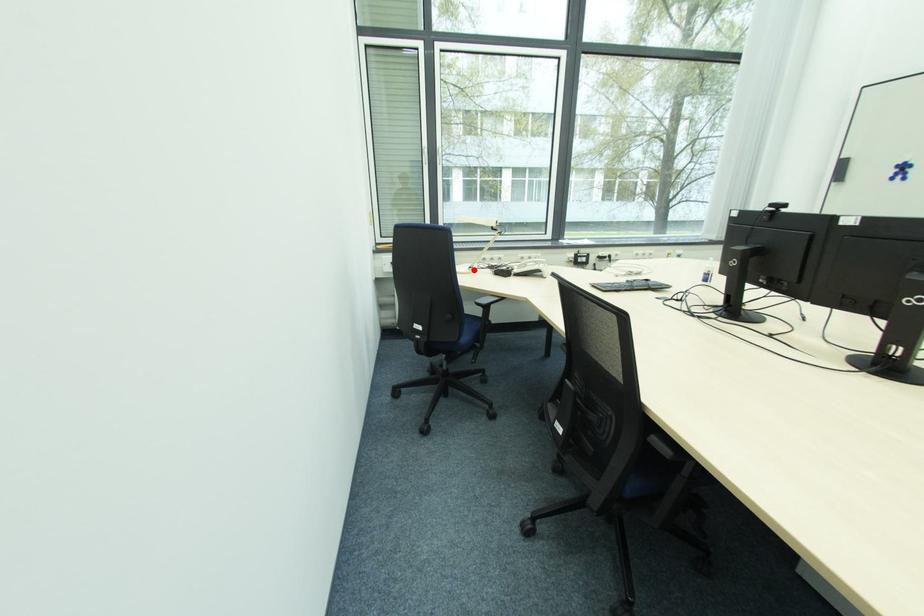
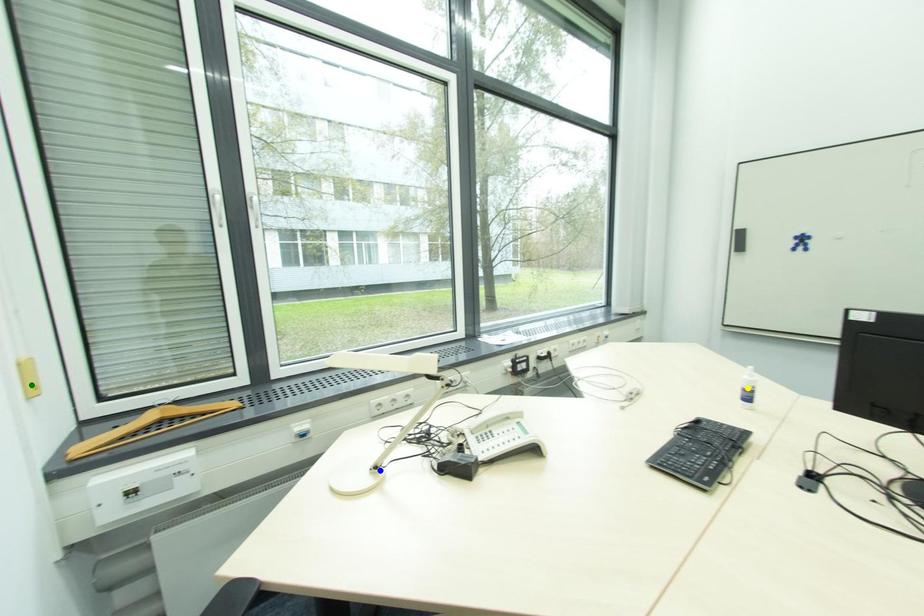
Question: I am providing you with two images of the same scene from different viewpoints. A red point is marked on the first image. You are given multiple points on the second image. Which point in image 2 is actually the same real-world point as the red point in image 1?

Choices:
 (A) yellow point
 (B) green point
 (C) blue point

Answer: (C)